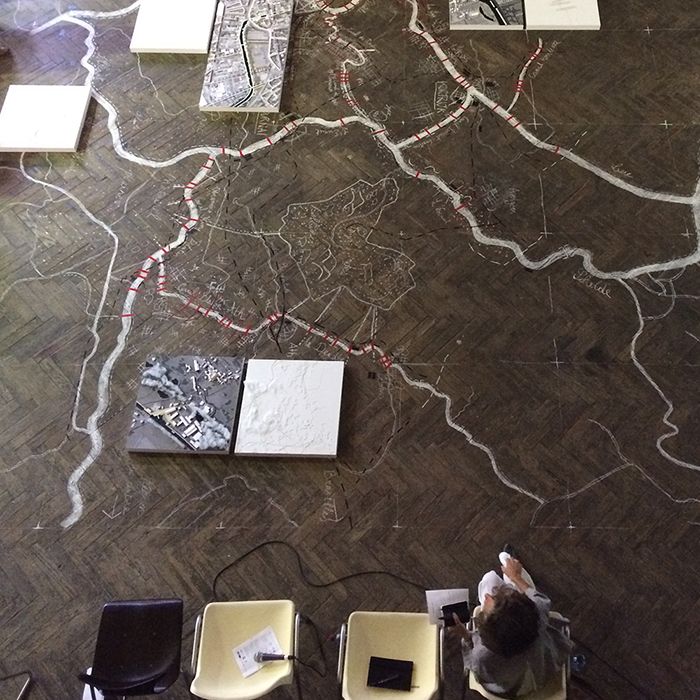
Find the location of a particular element. Image resolution: width=700 pixels, height=700 pixels. black chair is located at coordinates (155, 619).